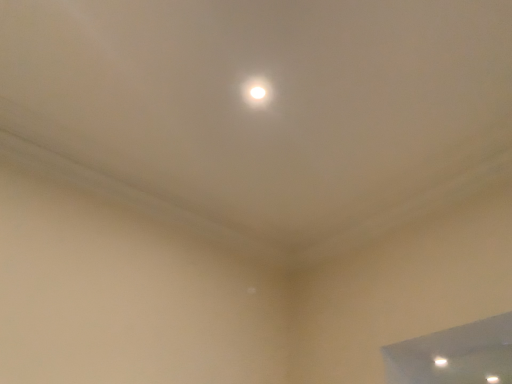
This screenshot has height=384, width=512. What do you see at coordinates (257, 91) in the screenshot? I see `white glossy light at upper center` at bounding box center [257, 91].

Locate an element on the screen. This screenshot has width=512, height=384. white glossy light at upper center is located at coordinates (257, 91).

At what (x,y) coordinates should I click in order to perform the action: click on white glossy light at upper center. Please return your answer as a coordinate pair (x, y). Looking at the image, I should click on (257, 91).